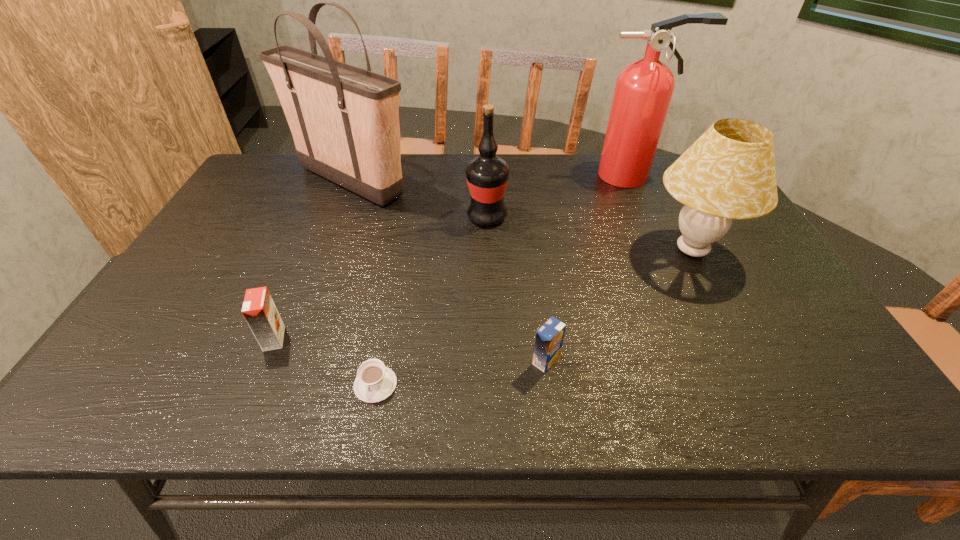
Find the location of a particular element. The height and width of the screenshot is (540, 960). lampshade located in the right edge section of the desktop is located at coordinates (729, 173).

In order to click on object at the far left corner in this screenshot , I will do coord(344,120).

Locate an element on the screen. The image size is (960, 540). object located at the far right corner is located at coordinates (643, 91).

Find the location of a particular element. The width and height of the screenshot is (960, 540). vacant space at the far edge of the desktop is located at coordinates (537, 173).

Find the location of `vacant point at the near edge`. vacant point at the near edge is located at coordinates (260, 395).

Locate an element on the screen. The height and width of the screenshot is (540, 960). vacant space at the left edge of the desktop is located at coordinates (x=209, y=312).

The image size is (960, 540). I want to click on vacant area at the right edge of the desktop, so click(769, 312).

I want to click on vacant space at the far left corner of the desktop, so click(x=250, y=186).

The image size is (960, 540). I want to click on vacant area at the near left corner of the desktop, so coord(165,404).

The height and width of the screenshot is (540, 960). Identify the location of empty space that is in between the shorter orange_juice and the left orange_juice. (410, 350).